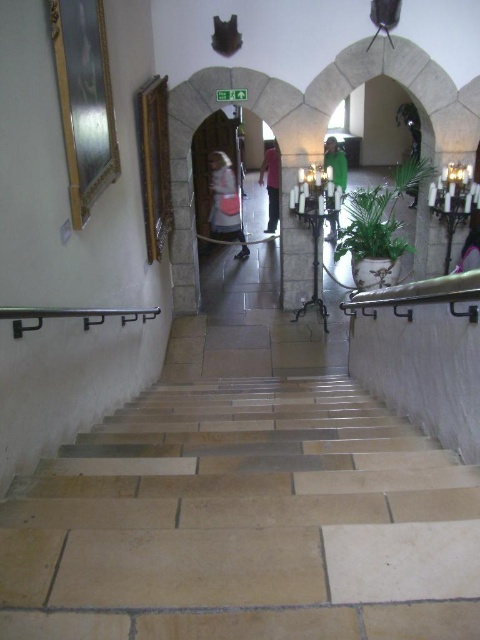
You are a delivery person carrying a large package that is 24 feet long. You need to navigate through the space between the light brown stone stairs at center and the green fabric at center. Can you safely pass through this area with your package without it getting stuck?

The distance between the light brown stone stairs at center and the green fabric at center is 23.94 feet. Since your package is 24 feet long, it is slightly longer than the available space, so you cannot safely pass through without the package getting stuck.

You are a painter who needs to place a large canvas between the light brown stone stairs at center and the green fabric at center. According to the scene description, which object should the canvas be placed to the right of?

The light brown stone stairs at center is positioned on the left side of green fabric at center, so the canvas should be placed to the right of the light brown stone stairs at center.

You are standing at the bottom of the staircase and want to pick up an item. The black polished metal handrail at lower left and the pink fabric dress at lower right are both visible. Which item is closer to you?

The black polished metal handrail at lower left is closer to you because it is in front of the pink fabric dress at lower right.